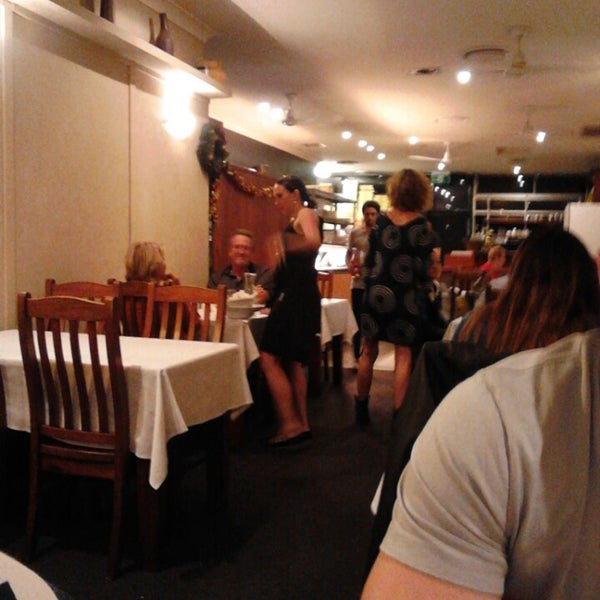
At what (x,y) coordinates should I click in order to perform the action: click on wall. Please return your answer as a coordinate pair (x, y). This screenshot has width=600, height=600. Looking at the image, I should click on (40, 198).